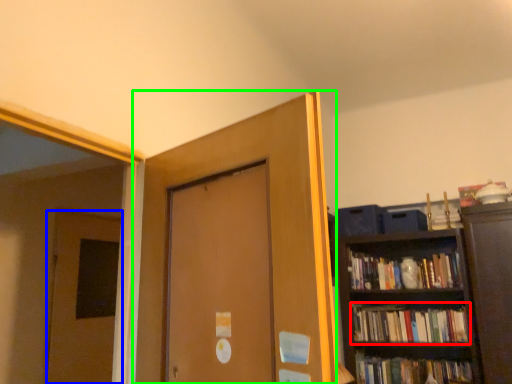
Question: Based on their relative distances, which object is nearer to book (highlighted by a red box)? Choose from door (highlighted by a blue box) and door (highlighted by a green box).

Choices:
 (A) door
 (B) door

Answer: (A)